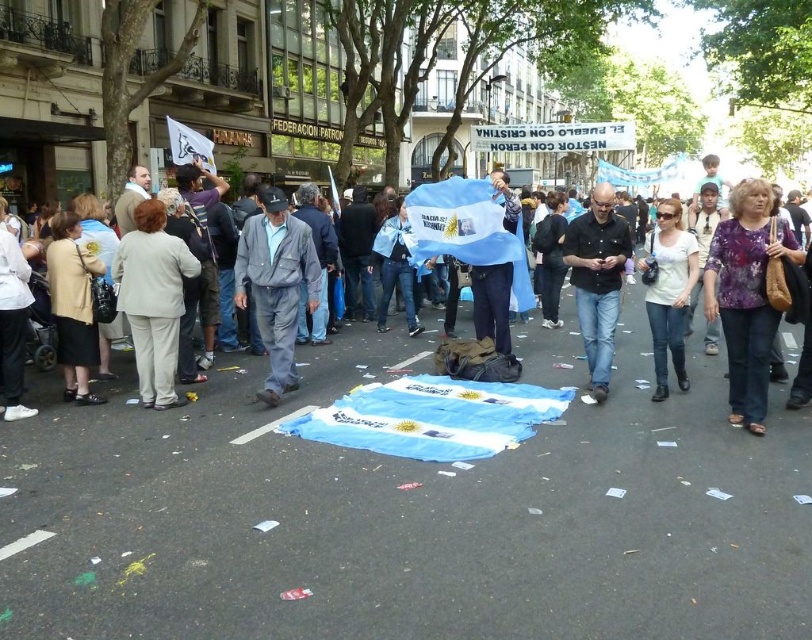
Looking at this image, you are a photographer standing on the street and want to take a picture of the black shirt at center and white cotton shirt at center. If your camera can capture an area up to 1 meter wide, will both shirts fit in the frame?

The black shirt at center is 1.03 meters from the white cotton shirt at center, so they are slightly more than 1 meter apart. Therefore, both shirts will not fit within the camera frame that can only capture up to 1 meter wide.

You are standing at the point with coordinates point (598, 218) in the lively street scene. You want to walk to the point with coordinates point (789, 236). Is the destination point in front of you or behind you?

The destination point (789, 236) is in front of point (598, 218), so the destination is in front of you.